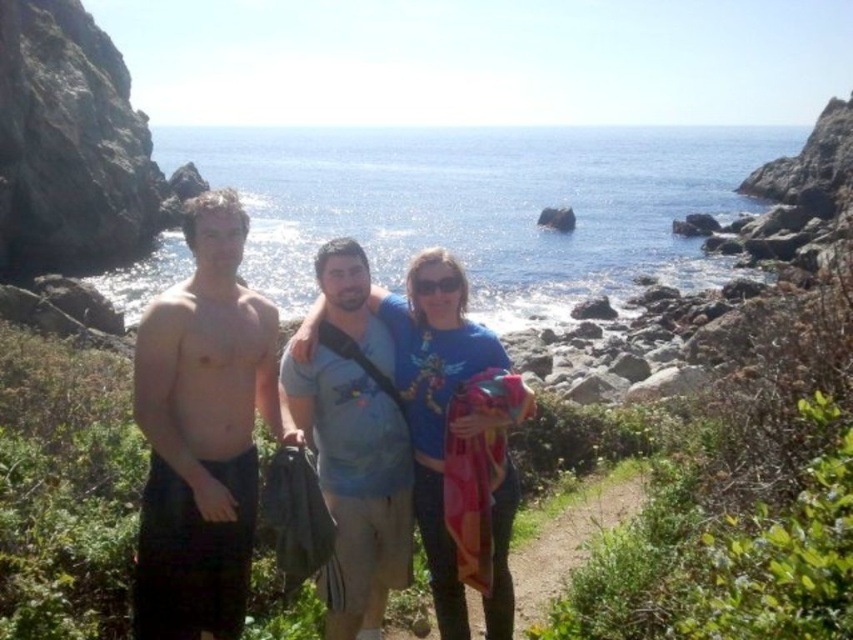
Question: Can you confirm if blue cotton t-shirt at center is positioned above shiny blue shirt at center?

Choices:
 (A) no
 (B) yes

Answer: (A)

Question: Which of these objects is positioned closest to the dirt path at center?

Choices:
 (A) blue cotton t-shirt at center
 (B) shiny blue shirt at center
 (C) blue cotton shirt at center

Answer: (C)

Question: Which object appears closest to the camera in this image?

Choices:
 (A) dirt path at center
 (B) blue cotton shirt at center
 (C) blue cotton t-shirt at center
 (D) shiny blue shirt at center

Answer: (D)

Question: Which of the following is the closest to the observer?

Choices:
 (A) (405, 387)
 (B) (221, 449)

Answer: (B)

Question: Can you confirm if blue cotton t-shirt at center is smaller than shiny blue shirt at center?

Choices:
 (A) yes
 (B) no

Answer: (A)

Question: Does dark brown shorts at left lie behind dirt path at center?

Choices:
 (A) yes
 (B) no

Answer: (B)